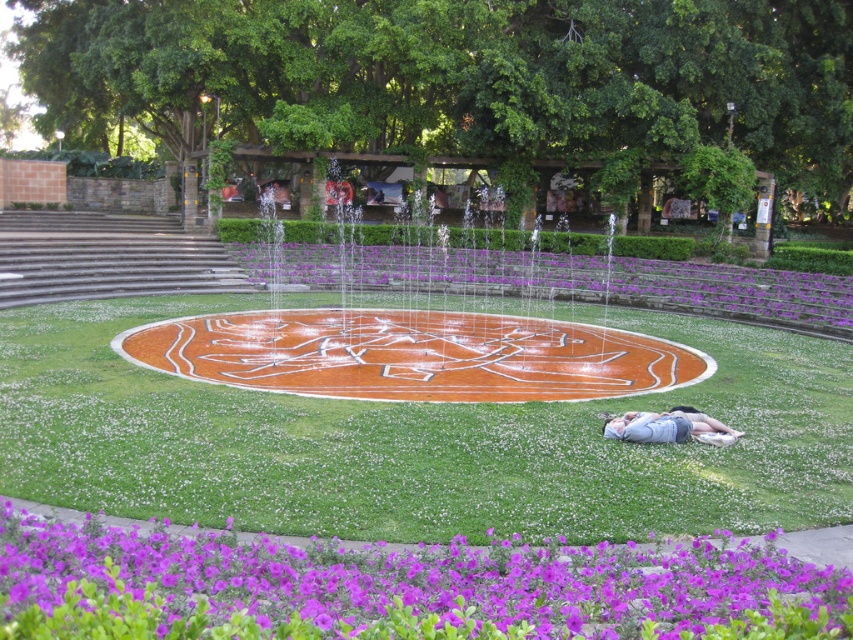
You are a gardener who wants to water the purple matte flower at lower left and the purple glossy flowers at center. Which one should you water first if you want to avoid getting the other wet?

The purple glossy flowers at center are above the purple matte flower at lower left, so watering the purple glossy flowers at center first would prevent water from dripping onto the purple matte flower at lower left below.

You are standing at the center of the circular fountain. Looking towards the lower left corner of the image, you see a point marked at coordinates (402, 588). What object is this point located on?

The point at (402, 588) is located on the purple matte flower at lower left.

You are standing at the center of the circular fountain. You want to walk to the purple matte flower at lower left. Which direction should you walk in?

The purple matte flower at lower left is located at point (402, 588), so you should walk towards the lower left direction from the center of the fountain.